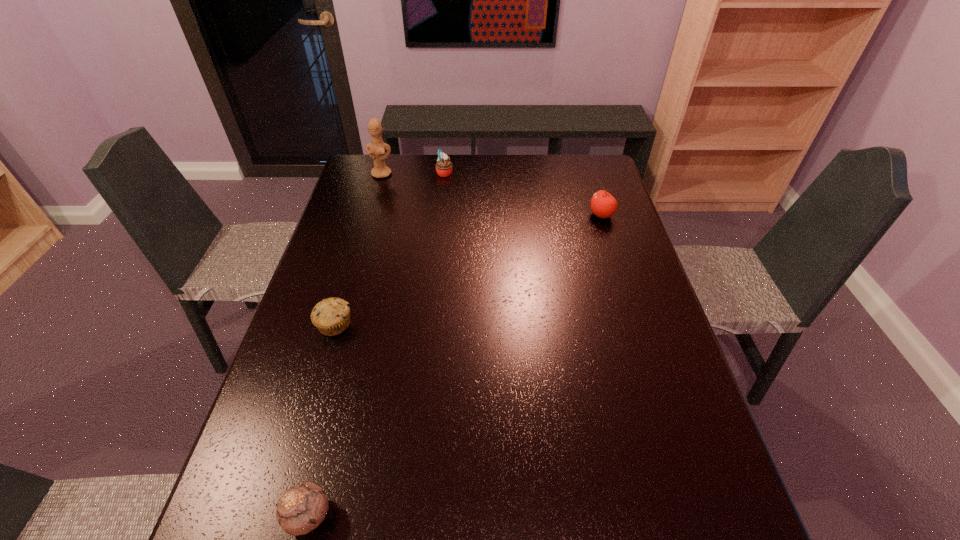
What are the coordinates of `figurine at the far edge` in the screenshot? It's located at (376, 149).

The width and height of the screenshot is (960, 540). Find the location of `muffin that is positioned at the far edge`. muffin that is positioned at the far edge is located at coordinates (443, 166).

Where is `figurine positioned at the left edge`? The image size is (960, 540). figurine positioned at the left edge is located at coordinates (376, 149).

The height and width of the screenshot is (540, 960). Identify the location of muffin located at the left edge. (331, 316).

You are a GUI agent. You are given a task and a screenshot of the screen. Output one action in this format:
    pyautogui.click(x=<x>, y=<y>)
    Task: Click on the object that is at the right edge
    The image size is (960, 540).
    Given the screenshot: What is the action you would take?
    [x=603, y=204]

Image resolution: width=960 pixels, height=540 pixels. In order to click on object at the far left corner in this screenshot , I will do `click(376, 149)`.

The image size is (960, 540). What are the coordinates of `free space at the far edge of the desktop` in the screenshot? It's located at tap(472, 185).

Where is `vacant space at the left edge of the desktop`? The image size is (960, 540). vacant space at the left edge of the desktop is located at coordinates (351, 310).

In the image, there is a desktop. Identify the location of vacant region at the right edge. This screenshot has height=540, width=960. (659, 508).

In order to click on vacant point at the far left corner in this screenshot , I will do `click(366, 164)`.